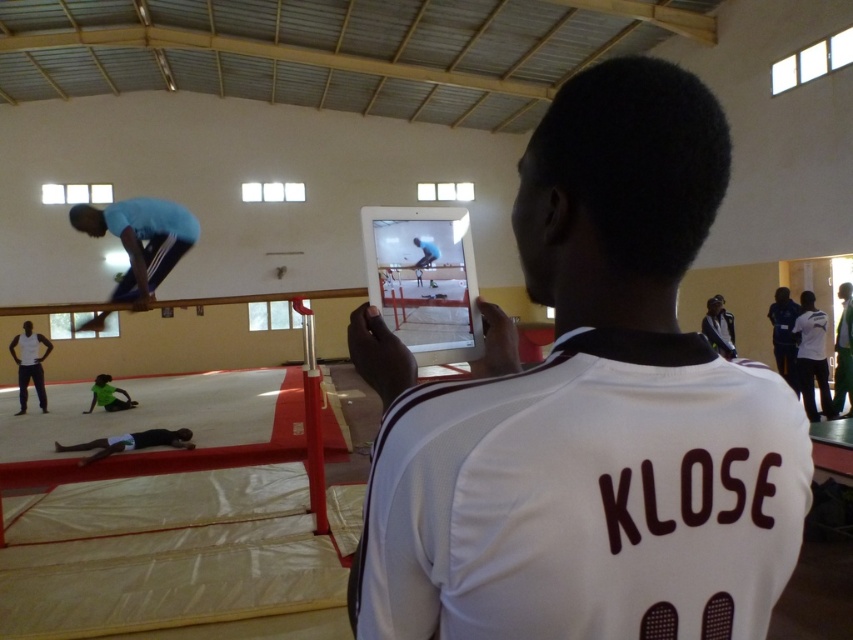
Looking at this image, you are standing in the gymnastics training room and see two points marked in the image. Which point, point [724,468] or point [183,218], is closer to you?

Point [724,468] is closer to the viewer than point [183,218].

You are a photographer setting up a camera to capture the scene. You need to adjust the zoom to ensure both the white jersey at center and the blue fabric pants at upper center are in focus. Given their sizes, which object should you focus on first to ensure proper focus?

The white jersey at center has a smaller size compared to blue fabric pants at upper center. Therefore, you should focus on the white jersey at center first since smaller objects require precise focus adjustments to ensure clarity.

In the scene shown: You are a photographer setting up a shot for a sports magazine. You want to ensure that both the white jersey at center and the blue fabric pants at upper center are clearly visible in the frame. Given their sizes, which object should you focus on first to ensure proper focus?

The white jersey at center is thinner than the blue fabric pants at upper center, so you should focus on the blue fabric pants at upper center first because thicker objects often require more precise focusing to capture details clearly.